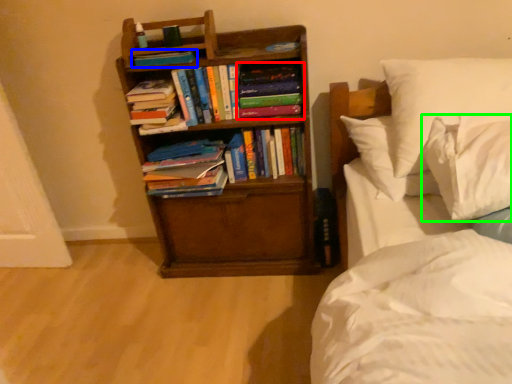
Question: Considering the real-world distances, which object is farthest from book (highlighted by a red box)? book (highlighted by a blue box) or pillow (highlighted by a green box)?

Choices:
 (A) book
 (B) pillow

Answer: (B)